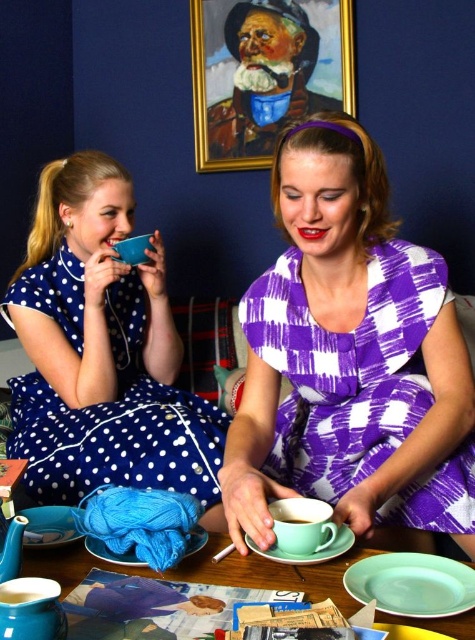
You are a photographer standing 3 feet away from the purple checkered dress at center and the white dotted fabric dress at left. You want to capture a photo where both dresses are in focus. Given that your camera can focus on objects within a 20 inch range, will both dresses be in focus?

The distance between the purple checkered dress at center and the white dotted fabric dress at left is 19.26 inches, which is within the camera focus range of 20 inches. Therefore, both dresses will be in focus.

You are a photographer setting up for a photoshoot. You need to place a decorative item between the white dotted fabric dress at left and the matte green saucer at lower center. Based on their sizes, which object should you position closer to the camera to ensure it doesn

The white dotted fabric dress at left might be wider than the matte green saucer at lower center, so positioning the dress closer to the camera would allow it to fill the frame appropriately while the saucer can be placed slightly further back to maintain balance.